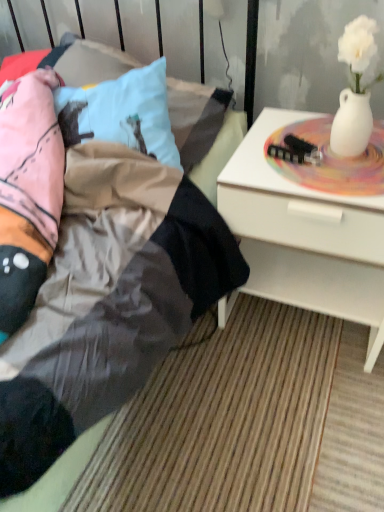
The height and width of the screenshot is (512, 384). I want to click on free space underneath white glossy desk at upper right (from a real-world perspective), so click(298, 323).